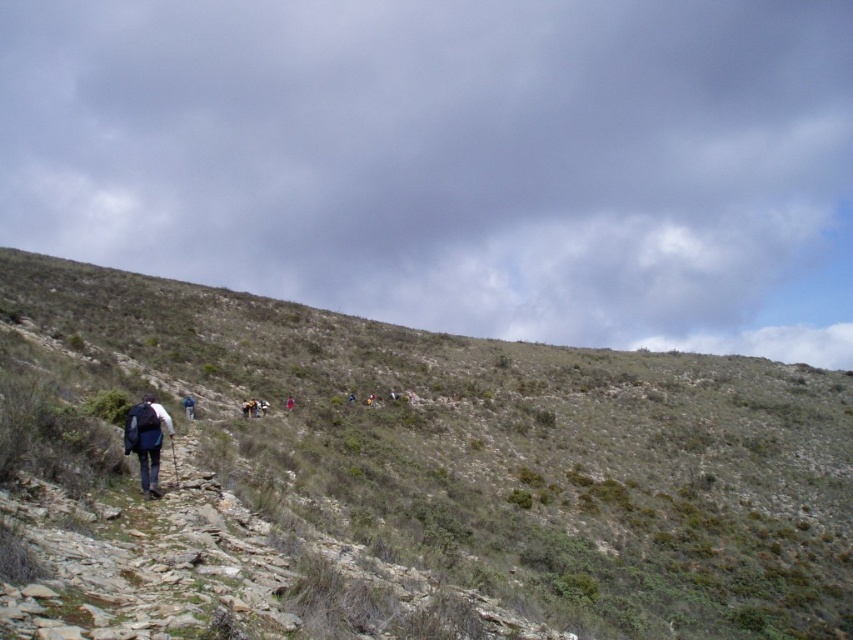
You are one of the hikers on the steep, rocky hillside. You notice a dark blue backpack at lower left and a red fabric person at center. Which object is positioned to the right of the other?

The dark blue backpack at lower left is to the right of the red fabric person at center.

Consider the image. You are a hiker trying to locate your dark blue backpack at lower left. You are currently standing on the green grassy hillside at center. Which direction should you move to find your backpack?

The dark blue backpack at lower left is behind the green grassy hillside at center, so you should move backward away from the direction of the green grassy hillside at center to locate it.